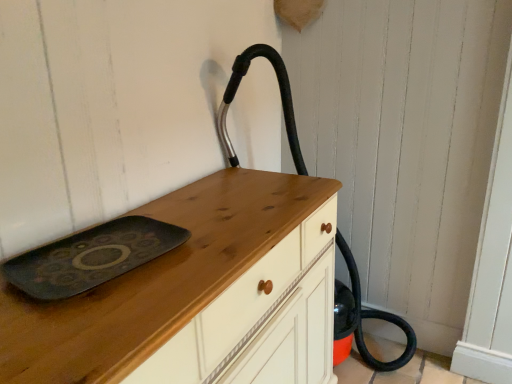
Where is `vacant space underneath matte black tray at center (from a real-world perspective)`? The height and width of the screenshot is (384, 512). vacant space underneath matte black tray at center (from a real-world perspective) is located at coordinates (95, 262).